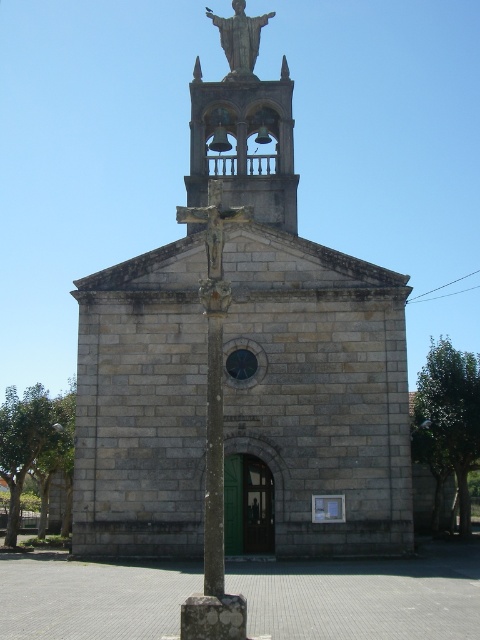
Question: Observing the image, what is the correct spatial positioning of gray stone church at center in reference to gold metallic statue at upper center?

Choices:
 (A) left
 (B) right

Answer: (A)

Question: Which point is farther to the camera?

Choices:
 (A) (216, 113)
 (B) (342, 310)

Answer: (A)

Question: Which is nearer to the gray stone church at center?

Choices:
 (A) gold metallic statue at upper center
 (B) bronze bell tower at upper center

Answer: (B)

Question: Does gray stone church at center come in front of bronze bell tower at upper center?

Choices:
 (A) yes
 (B) no

Answer: (A)

Question: Does bronze bell tower at upper center appear over gold metallic statue at upper center?

Choices:
 (A) yes
 (B) no

Answer: (B)

Question: Among these points, which one is nearest to the camera?

Choices:
 (A) (375, 417)
 (B) (195, 156)

Answer: (A)